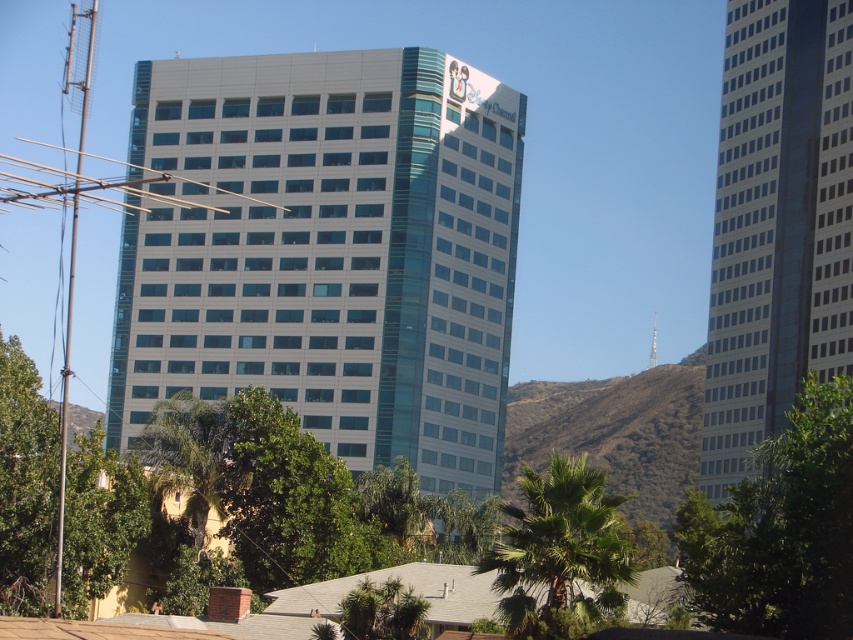
You are standing in front of the Disney Channel building and want to take a photo that includes both the glassy white skyscraper at right and the green leafy tree at right. Which object should you position closer to the edge of the frame to ensure both fit in the photo?

Since the glassy white skyscraper at right is narrower than the green leafy tree at right, you should position the wider green leafy tree at right closer to the edge of the frame to ensure both fit in the photo.

You are a photographer planning to capture the matte glass building at center and the green leafy palm tree at lower center in a single frame. Based on their sizes, which object should you focus on to ensure both fit well in the composition?

The matte glass building at center is wider than the green leafy palm tree at lower center, so focusing on the building will help ensure both fit well in the composition since it occupies more space.